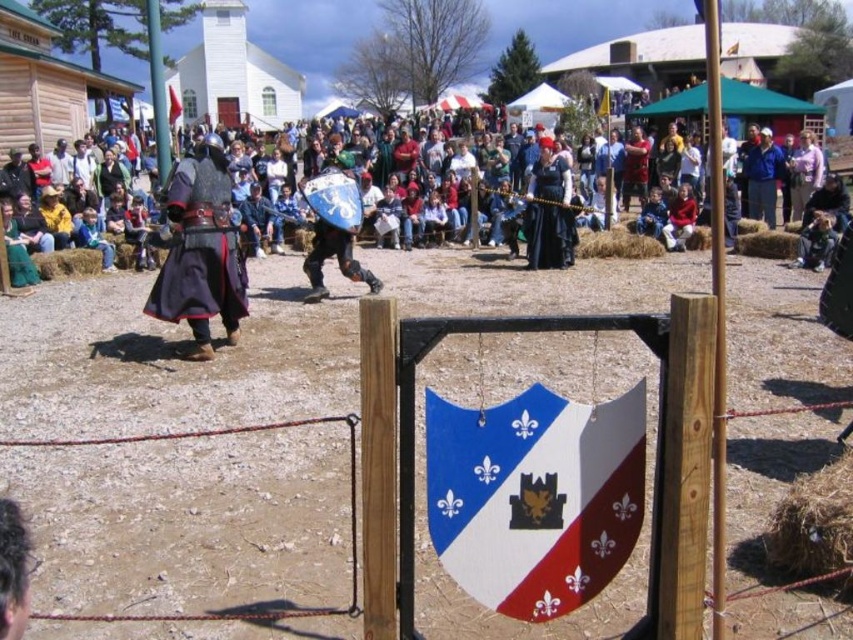
Question: Is wooden shield at center bigger than shiny black armor at center?

Choices:
 (A) yes
 (B) no

Answer: (B)

Question: Which point appears farthest from the camera in this image?

Choices:
 (A) (552, 256)
 (B) (318, 260)
 (C) (20, 394)
 (D) (181, 109)

Answer: (D)

Question: Among these points, which one is nearest to the camera?

Choices:
 (A) (535, 172)
 (B) (439, 292)

Answer: (B)

Question: Can you confirm if shiny blue shield at center is positioned below red fabric flag at upper center?

Choices:
 (A) yes
 (B) no

Answer: (A)

Question: Among these objects, which one is farthest from the camera?

Choices:
 (A) black velvet dress at center
 (B) shiny black armor at center
 (C) red fabric flag at upper center
 (D) wooden shield at center

Answer: (C)

Question: Can you confirm if dirt field at center is positioned above dark clothing at center?

Choices:
 (A) yes
 (B) no

Answer: (B)